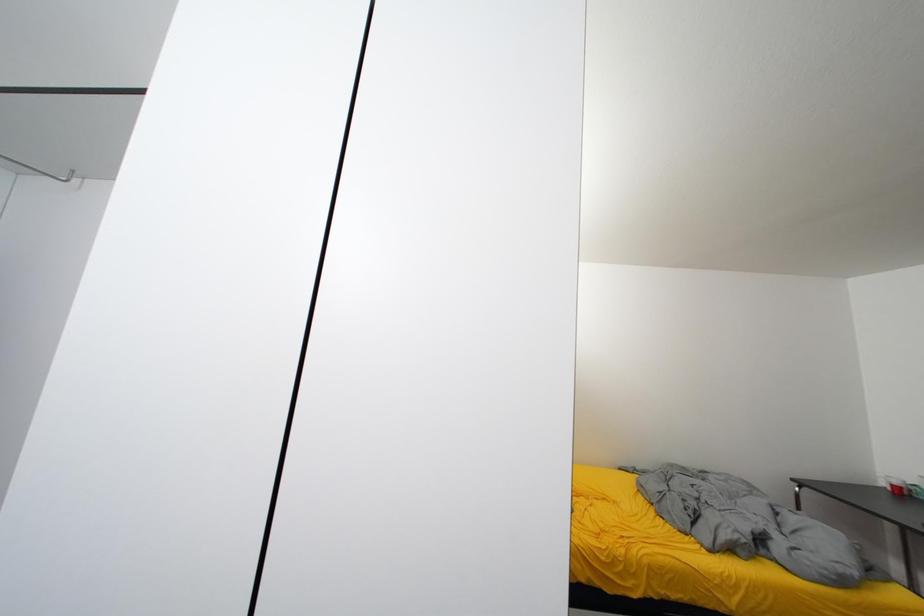
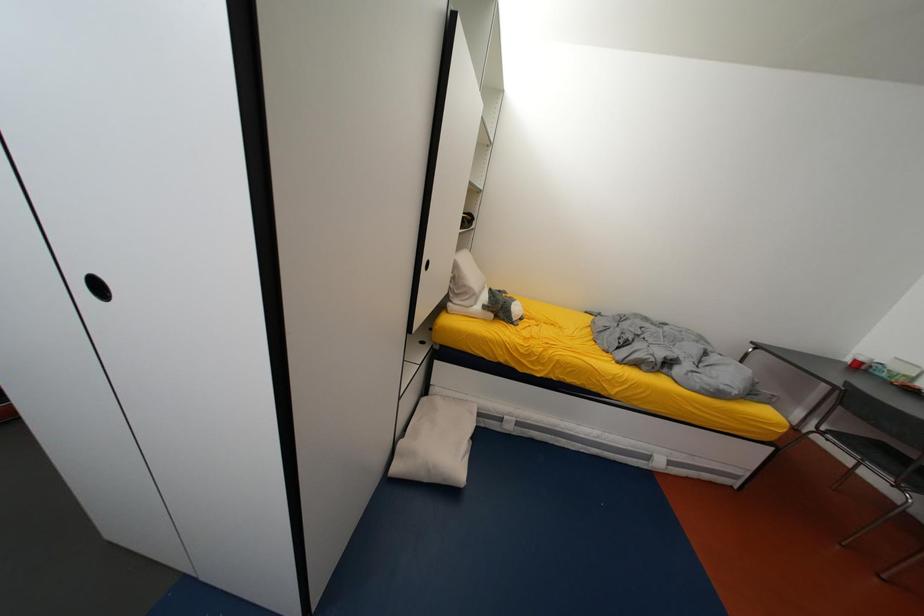
Question: The images are taken continuously from a first-person perspective. In which direction is your viewpoint rotating?

Choices:
 (A) Left
 (B) Right
 (C) Up
 (D) Down

Answer: (D)